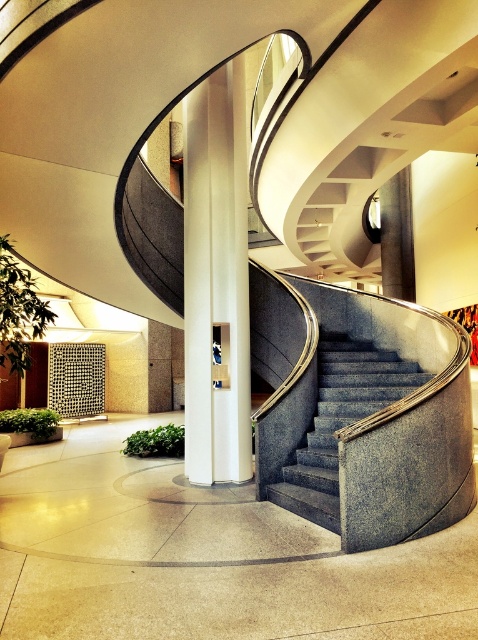
Question: Considering the relative positions of granite gray stairs at center and white glossy pillar at upper center in the image provided, where is granite gray stairs at center located with respect to white glossy pillar at upper center?

Choices:
 (A) below
 (B) above

Answer: (A)

Question: Estimate the real-world distances between objects in this image. Which object is closer to the gray granite stairs at center?

Choices:
 (A) white glossy pillar at center
 (B) granite gray stairs at center

Answer: (A)

Question: Which object is positioned farthest from the white glossy pillar at center?

Choices:
 (A) gray granite stairs at center
 (B) white glossy pillar at upper center

Answer: (B)

Question: Observing the image, what is the correct spatial positioning of white glossy pillar at center in reference to white glossy pillar at upper center?

Choices:
 (A) below
 (B) above

Answer: (A)

Question: Is granite gray stairs at center above gray granite stairs at center?

Choices:
 (A) no
 (B) yes

Answer: (B)

Question: Which point is farther to the camera?

Choices:
 (A) (395, 195)
 (B) (355, 412)

Answer: (A)